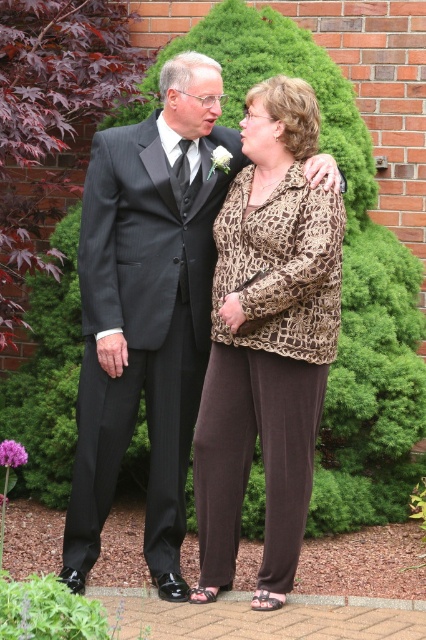
Is leopard print blouse at center below dark gray pinstripe suit at left?

No, leopard print blouse at center is not below dark gray pinstripe suit at left.

Locate an element on the screen. Image resolution: width=426 pixels, height=640 pixels. leopard print blouse at center is located at coordinates (267, 340).